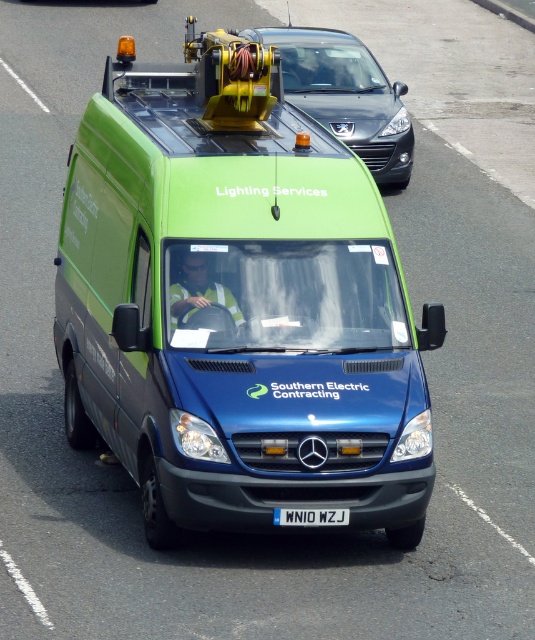
You are a delivery person who needs to park this vehicle in a parking spot that is exactly the width of the white plastic license plate at center. Can the green matte van at center fit into this parking spot?

The green matte van at center might be wider than white plastic license plate at center, so it may not fit into the parking spot.